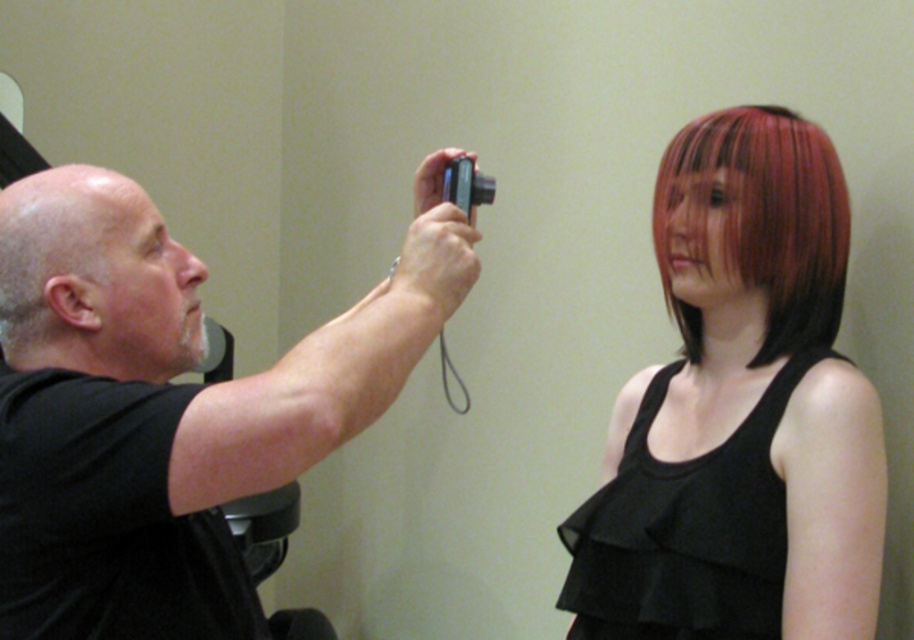
You are a photographer trying to frame a shot. The black matte camera at upper left and the shiny red hair at right are both in your viewfinder. Which object is wider?

The black matte camera at upper left is wider than the shiny red hair at right.

You are a photographer who needs to capture a closeup shot of the shiny red hair at upper right. The camera you have is the black matte camera at upper left. Can you get a clear shot without moving either the camera or the subject?

The shiny red hair at upper right is 22.85 inches away from the black matte camera at upper left. Since the distance is within the camera lens range, you can capture a clear closeup shot without moving either the camera or the subject.